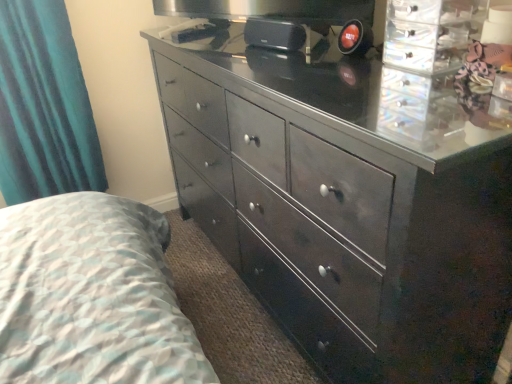
Where is `glossy dark wood dresser at center`? The width and height of the screenshot is (512, 384). glossy dark wood dresser at center is located at coordinates (348, 203).

The width and height of the screenshot is (512, 384). What do you see at coordinates (348, 203) in the screenshot?
I see `glossy dark wood dresser at center` at bounding box center [348, 203].

In order to face glossy dark wood dresser at center, should I rotate leftwards or rightwards?

Rotate right and turn 5.244 degrees.

Image resolution: width=512 pixels, height=384 pixels. Find the location of `teal velvet curtain at left`. teal velvet curtain at left is located at coordinates (44, 106).

This screenshot has height=384, width=512. What do you see at coordinates (44, 106) in the screenshot?
I see `teal velvet curtain at left` at bounding box center [44, 106].

You are a GUI agent. You are given a task and a screenshot of the screen. Output one action in this format:
    pyautogui.click(x=<x>, y=<y>)
    Task: Click on the glossy dark wood dresser at center
    The height and width of the screenshot is (384, 512).
    Given the screenshot: What is the action you would take?
    pyautogui.click(x=348, y=203)

Can you confirm if teal velvet curtain at left is positioned to the right of glossy dark wood dresser at center?

In fact, teal velvet curtain at left is to the left of glossy dark wood dresser at center.

Considering their positions, is teal velvet curtain at left located in front of or behind glossy dark wood dresser at center?

In the image, teal velvet curtain at left appears behind glossy dark wood dresser at center.

Is point (31, 101) closer to viewer compared to point (275, 124)?

That is False.

From the image's perspective, who appears lower, teal velvet curtain at left or glossy dark wood dresser at center?

glossy dark wood dresser at center appears lower in the image.

From a real-world perspective, does teal velvet curtain at left sit lower than glossy dark wood dresser at center?

No, from a real-world perspective, teal velvet curtain at left is not beneath glossy dark wood dresser at center.

Can you confirm if teal velvet curtain at left is wider than glossy dark wood dresser at center?

In fact, teal velvet curtain at left might be narrower than glossy dark wood dresser at center.

Who is taller, teal velvet curtain at left or glossy dark wood dresser at center?

glossy dark wood dresser at center is taller.

Can you confirm if teal velvet curtain at left is bigger than glossy dark wood dresser at center?

Incorrect, teal velvet curtain at left is not larger than glossy dark wood dresser at center.

Do you think teal velvet curtain at left is within glossy dark wood dresser at center, or outside of it?

teal velvet curtain at left is not inside glossy dark wood dresser at center, it's outside.

Is teal velvet curtain at left directly adjacent to glossy dark wood dresser at center?

No, teal velvet curtain at left is not in contact with glossy dark wood dresser at center.

Is teal velvet curtain at left oriented away from glossy dark wood dresser at center?

That's not correct — teal velvet curtain at left is not looking away from glossy dark wood dresser at center.

What's the angular difference between teal velvet curtain at left and glossy dark wood dresser at center's facing directions?

88.5 degrees.

How far apart are teal velvet curtain at left and glossy dark wood dresser at center?

36.59 inches.

What are the coordinates of `curtain above the glossy dark wood dresser at center (from the image's perspective)` in the screenshot? It's located at (44, 106).

Based on their positions, is glossy dark wood dresser at center located to the left or right of teal velvet curtain at left?

glossy dark wood dresser at center is positioned on teal velvet curtain at left's right side.

Considering the positions of objects glossy dark wood dresser at center and teal velvet curtain at left in the image provided, who is in front, glossy dark wood dresser at center or teal velvet curtain at left?

glossy dark wood dresser at center is more forward.

Does point (490, 141) appear closer or farther from the camera than point (18, 151)?

Point (490, 141) is positioned closer to the camera compared to point (18, 151).

From the image's perspective, which one is positioned lower, glossy dark wood dresser at center or teal velvet curtain at left?

glossy dark wood dresser at center, from the image's perspective.

From a real-world perspective, who is located lower, glossy dark wood dresser at center or teal velvet curtain at left?

glossy dark wood dresser at center is physically lower.

Which object is wider, glossy dark wood dresser at center or teal velvet curtain at left?

Wider between the two is glossy dark wood dresser at center.

Considering the sizes of glossy dark wood dresser at center and teal velvet curtain at left in the image, is glossy dark wood dresser at center taller or shorter than teal velvet curtain at left?

Considering their sizes, glossy dark wood dresser at center has more height than teal velvet curtain at left.

Who is smaller, glossy dark wood dresser at center or teal velvet curtain at left?

Smaller between the two is teal velvet curtain at left.

Would you say teal velvet curtain at left is part of glossy dark wood dresser at center's contents?

No, teal velvet curtain at left is not a part of glossy dark wood dresser at center.

Is glossy dark wood dresser at center touching teal velvet curtain at left?

No, glossy dark wood dresser at center is not in contact with teal velvet curtain at left.

Based on the photo, is glossy dark wood dresser at center aimed at teal velvet curtain at left?

Yes, glossy dark wood dresser at center faces towards teal velvet curtain at left.

What's the angular difference between glossy dark wood dresser at center and teal velvet curtain at left's facing directions?

glossy dark wood dresser at center and teal velvet curtain at left are facing 88.5 degrees away from each other.

Where is `curtain on the left of glossy dark wood dresser at center`? curtain on the left of glossy dark wood dresser at center is located at coordinates (44, 106).

In the image, there is a glossy dark wood dresser at center. Where is `curtain above it (from the image's perspective)`? Image resolution: width=512 pixels, height=384 pixels. curtain above it (from the image's perspective) is located at coordinates pos(44,106).

At what (x,y) coordinates should I click in order to perform the action: click on the chest of drawers that is below the teal velvet curtain at left (from the image's perspective). Please return your answer as a coordinate pair (x, y). Looking at the image, I should click on (348, 203).